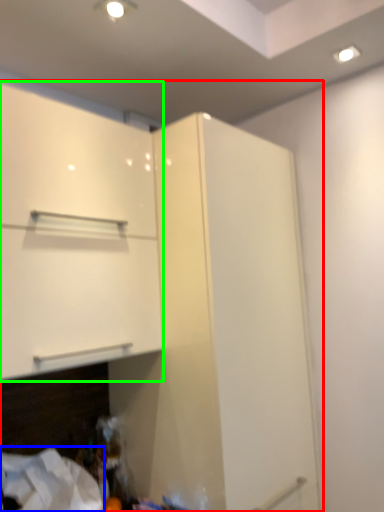
Question: Based on their relative distances, which object is nearer to cupboard (highlighted by a red box)? Choose from sheet (highlighted by a blue box) and cabinetry (highlighted by a green box).

Choices:
 (A) sheet
 (B) cabinetry

Answer: (B)